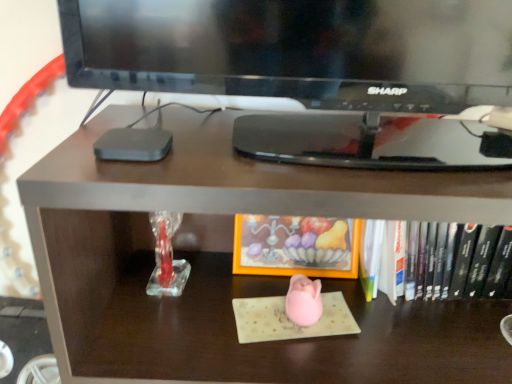
Question: Which direction should I rotate to look at orange matte frame at center, acting as the second book starting from the right?

Choices:
 (A) left
 (B) right

Answer: (B)

Question: Considering the relative positions of orange matte frame at center, acting as the second book starting from the right, and hardcover book at center, which is the 2th book from left to right, in the image provided, is orange matte frame at center, acting as the second book starting from the right, to the right of hardcover book at center, which is the 2th book from left to right, from the viewer's perspective?

Choices:
 (A) no
 (B) yes

Answer: (A)

Question: Considering the relative sizes of orange matte frame at center, acting as the second book starting from the right, and hardcover book at center, which appears as the first book when viewed from the right, in the image provided, is orange matte frame at center, acting as the second book starting from the right, wider than hardcover book at center, which appears as the first book when viewed from the right,?

Choices:
 (A) yes
 (B) no

Answer: (B)

Question: Can you confirm if orange matte frame at center, acting as the second book starting from the right, is thinner than hardcover book at center, which is the 2th book from left to right?

Choices:
 (A) yes
 (B) no

Answer: (A)

Question: Is orange matte frame at center, which is counted as the 1th book, starting from the left, placed right next to hardcover book at center, which is the 2th book from left to right?

Choices:
 (A) no
 (B) yes

Answer: (A)

Question: From the image's perspective, is orange matte frame at center, acting as the second book starting from the right, below hardcover book at center, which appears as the first book when viewed from the right?

Choices:
 (A) no
 (B) yes

Answer: (A)

Question: Considering the relative sizes of orange matte frame at center, which is counted as the 1th book, starting from the left, and hardcover book at center, which is the 2th book from left to right, in the image provided, is orange matte frame at center, which is counted as the 1th book, starting from the left, taller than hardcover book at center, which is the 2th book from left to right,?

Choices:
 (A) no
 (B) yes

Answer: (B)

Question: Considering the relative sizes of orange matte frame at center, acting as the second book starting from the right, and matte brown desk at center in the image provided, is orange matte frame at center, acting as the second book starting from the right, taller than matte brown desk at center?

Choices:
 (A) no
 (B) yes

Answer: (A)

Question: Considering the relative sizes of orange matte frame at center, acting as the second book starting from the right, and matte brown desk at center in the image provided, is orange matte frame at center, acting as the second book starting from the right, smaller than matte brown desk at center?

Choices:
 (A) no
 (B) yes

Answer: (B)

Question: Is orange matte frame at center, acting as the second book starting from the right, further to camera compared to matte brown desk at center?

Choices:
 (A) yes
 (B) no

Answer: (A)

Question: Is orange matte frame at center, which is counted as the 1th book, starting from the left, positioned before matte brown desk at center?

Choices:
 (A) yes
 (B) no

Answer: (B)

Question: Is orange matte frame at center, acting as the second book starting from the right, located outside matte brown desk at center?

Choices:
 (A) no
 (B) yes

Answer: (A)

Question: From the image's perspective, is orange matte frame at center, acting as the second book starting from the right, over matte brown desk at center?

Choices:
 (A) no
 (B) yes

Answer: (B)

Question: Is matte brown desk at center positioned with its back to orange matte frame at center, acting as the second book starting from the right?

Choices:
 (A) no
 (B) yes

Answer: (B)